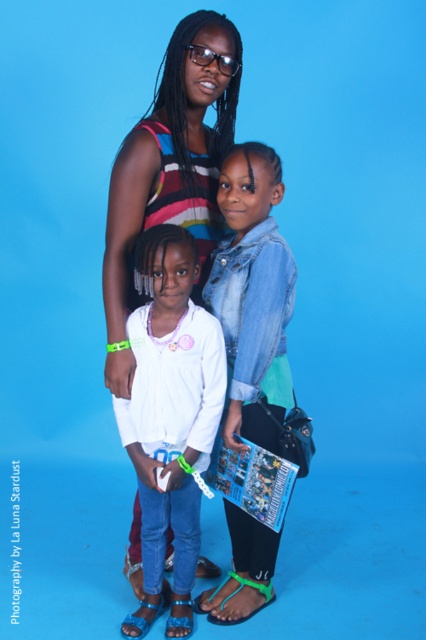
Does white matte shirt at center appear over striped knit sweater at center?

Actually, white matte shirt at center is below striped knit sweater at center.

At what (x,y) coordinates should I click in order to perform the action: click on white matte shirt at center. Please return your answer as a coordinate pair (x, y). This screenshot has height=640, width=426. Looking at the image, I should click on (169, 416).

This screenshot has width=426, height=640. Identify the location of white matte shirt at center. (169, 416).

Looking at this image, is white matte shirt at center in front of green rubber sandal at lower center?

Yes.

Does white matte shirt at center appear on the right side of green rubber sandal at lower center?

Incorrect, white matte shirt at center is not on the right side of green rubber sandal at lower center.

The image size is (426, 640). In order to click on white matte shirt at center in this screenshot , I will do `click(169, 416)`.

This screenshot has height=640, width=426. Identify the location of white matte shirt at center. (169, 416).

Is denim jacket at center above green rubber sandal at lower center?

Yes.

Is denim jacket at center shorter than green rubber sandal at lower center?

No.

Does point (215, 301) come farther from viewer compared to point (222, 624)?

No, it is not.

Identify the location of denim jacket at center. (253, 296).